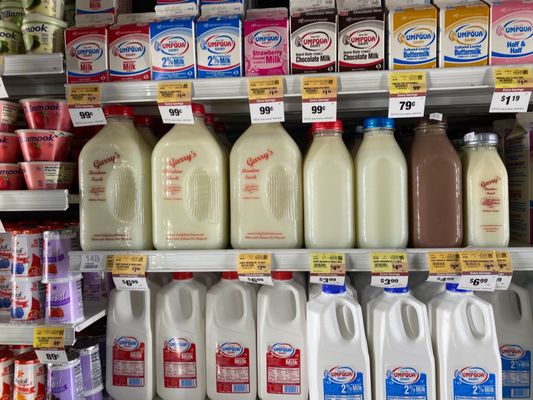
Where is `shelves`? shelves is located at coordinates (4, 335), (20, 204), (33, 67), (216, 89), (209, 261).